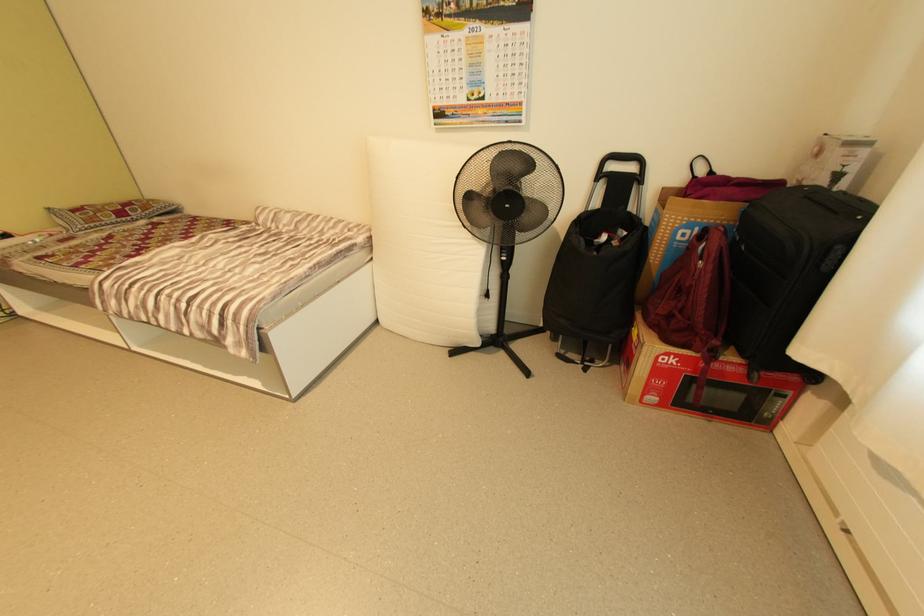
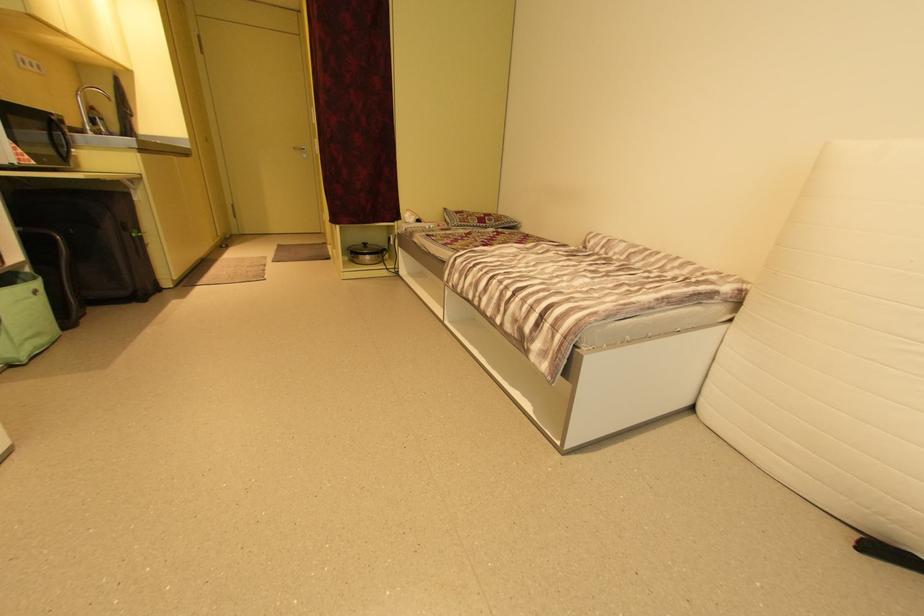
Question: The first image is from the beginning of the video and the second image is from the end. How did the camera likely rotate when shooting the video?

Choices:
 (A) Left
 (B) Right
 (C) Up
 (D) Down

Answer: (A)